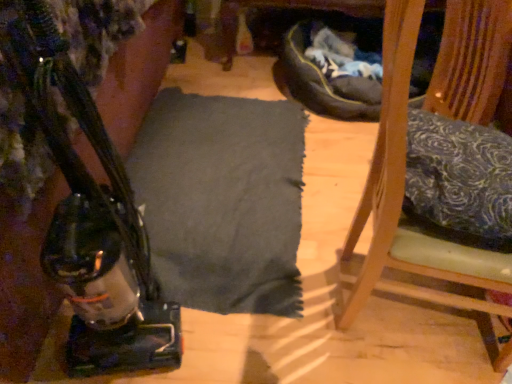
Question: From the image's perspective, is wooden chair at right positioned above or below blue floral fabric pillow at right?

Choices:
 (A) above
 (B) below

Answer: (B)

Question: Considering the positions of wooden chair at right and blue floral fabric pillow at right in the image, is wooden chair at right taller or shorter than blue floral fabric pillow at right?

Choices:
 (A) short
 (B) tall

Answer: (B)

Question: Which object is positioned closest to the matte black vacuum cleaner at left?

Choices:
 (A) wooden chair at right
 (B) blue floral fabric pillow at right

Answer: (A)

Question: Considering the real-world distances, which object is farthest from the blue floral fabric pillow at right?

Choices:
 (A) wooden chair at right
 (B) matte black vacuum cleaner at left

Answer: (B)